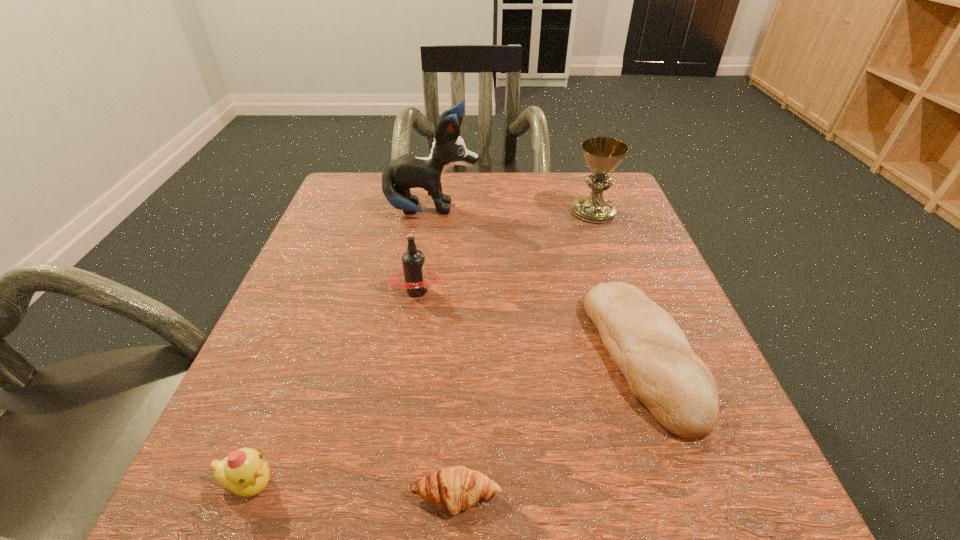
Identify the location of free space between the second shortest object and the tallest object. The width and height of the screenshot is (960, 540). (538, 283).

Locate an element on the screen. Image resolution: width=960 pixels, height=540 pixels. vacant space that's between the fourth tallest object and the chalice is located at coordinates (421, 348).

Identify the location of free spot between the chalice and the shortest object. Image resolution: width=960 pixels, height=540 pixels. (525, 354).

Locate an element on the screen. vacant space that is in between the third shortest object and the fifth shortest object is located at coordinates (421, 348).

Locate an element on the screen. This screenshot has height=540, width=960. free point between the fourth tallest object and the chalice is located at coordinates coord(421,348).

Identify the location of free space between the puppy and the chalice. This screenshot has height=540, width=960. (513, 211).

This screenshot has width=960, height=540. I want to click on empty space that is in between the root beer and the puppy, so click(425, 251).

Point out which object is positioned as the third nearest to the third tallest object. Please provide its 2D coordinates. Your answer should be formatted as a tuple, i.e. [(x, y)], where the tuple contains the x and y coordinates of a point satisfying the conditions above.

[(244, 472)]

Point out which object is positioned as the fourth nearest to the shortest object. Please provide its 2D coordinates. Your answer should be formatted as a tuple, i.e. [(x, y)], where the tuple contains the x and y coordinates of a point satisfying the conditions above.

[(408, 171)]

Identify the location of vacant point that satisfies the following two spatial constraints: 1. on the front-facing side of the tallest object; 2. on the back side of the chalice. The image size is (960, 540). (432, 212).